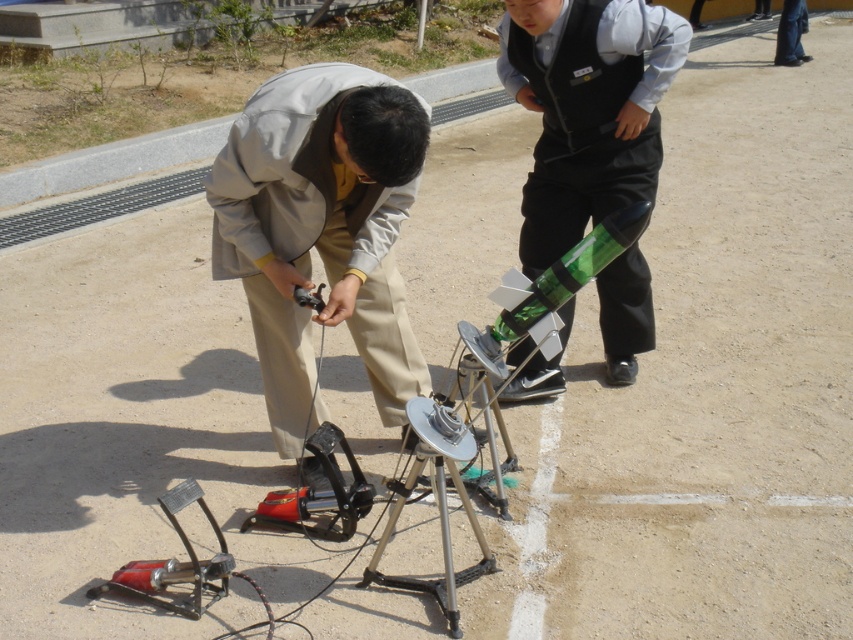
Can you confirm if matte gray jacket at center is shorter than green plastic rocket at center?

Correct, matte gray jacket at center is not as tall as green plastic rocket at center.

Does point (282, 337) lie in front of point (625, 28)?

Yes, point (282, 337) is in front of point (625, 28).

Find the location of `matte gray jacket at center`. matte gray jacket at center is located at coordinates (x=321, y=230).